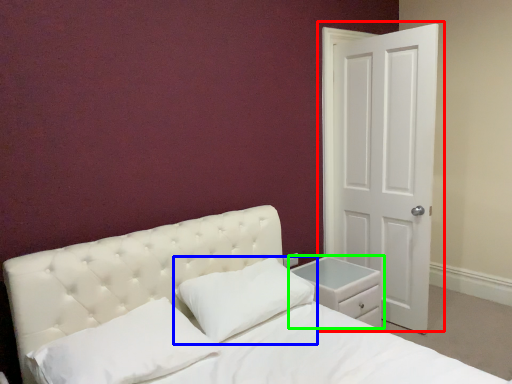
Question: Which object is positioned closest to door (highlighted by a red box)? Select from pillow (highlighted by a blue box) and nightstand (highlighted by a green box).

Choices:
 (A) pillow
 (B) nightstand

Answer: (B)